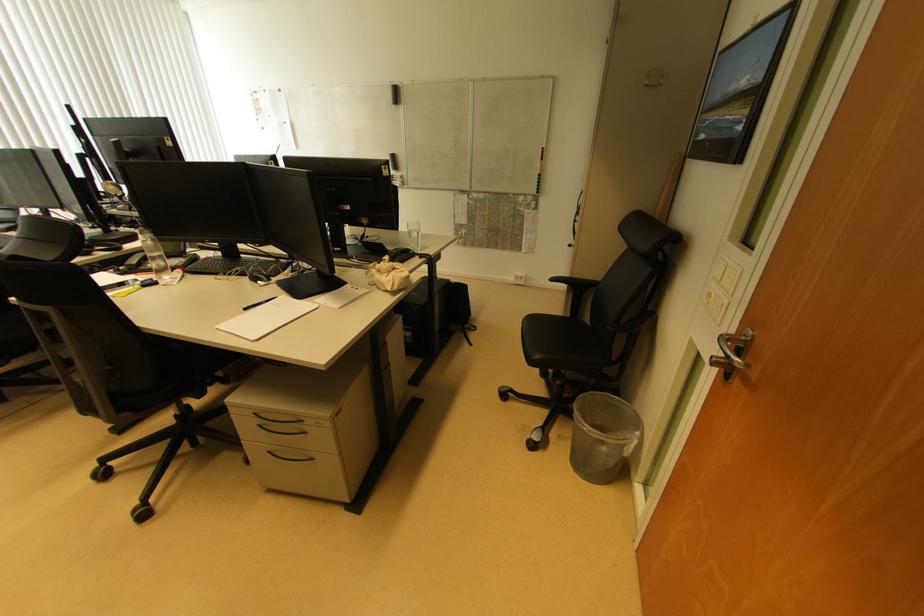
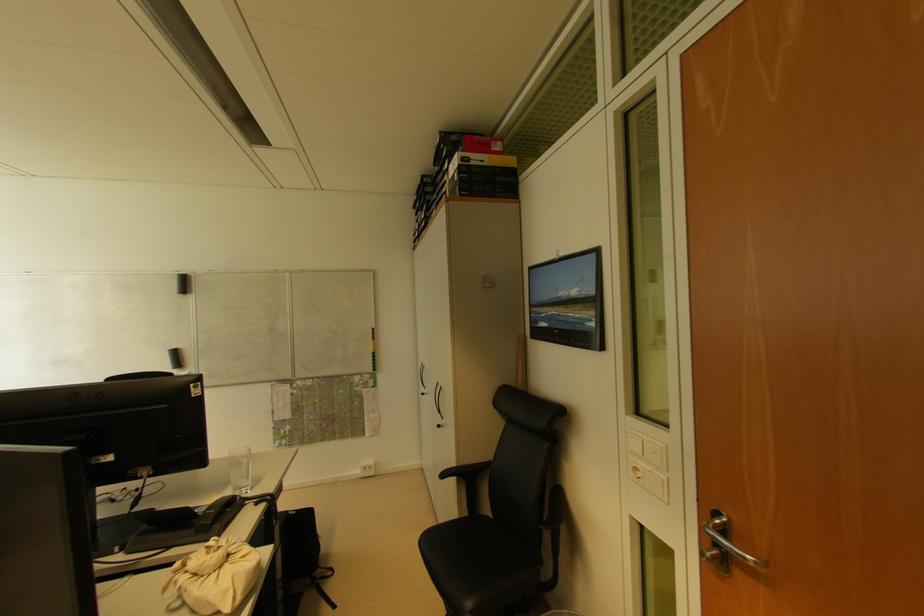
How did the camera likely rotate?

The rotation direction of the camera is right-up.